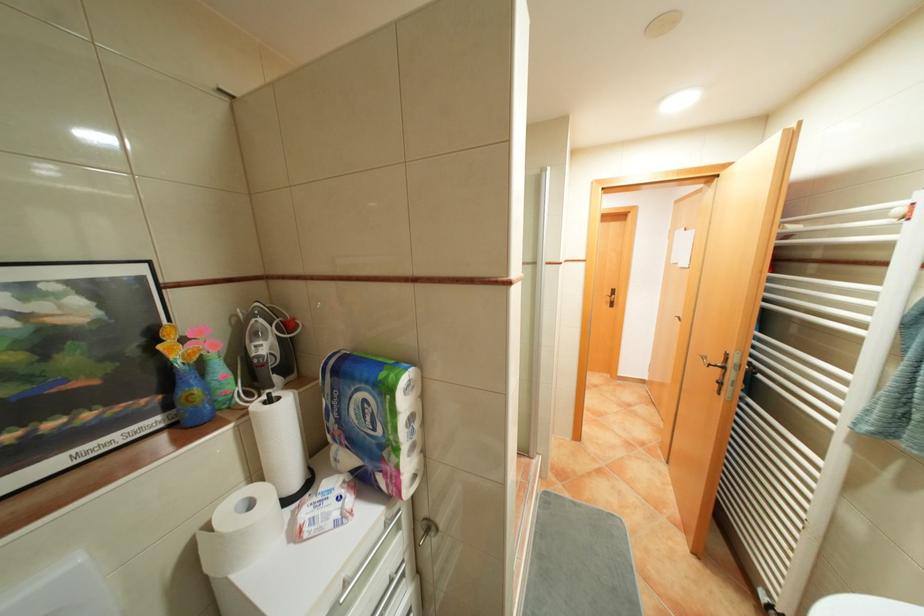
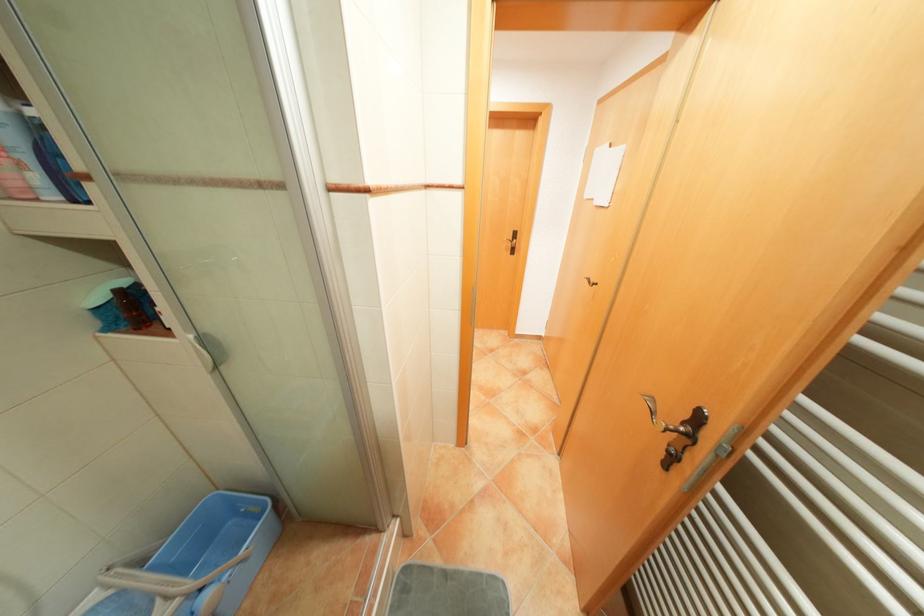
The images are taken continuously from a first-person perspective. In which direction are you moving?

The movement direction of the cameraman is right, forward.